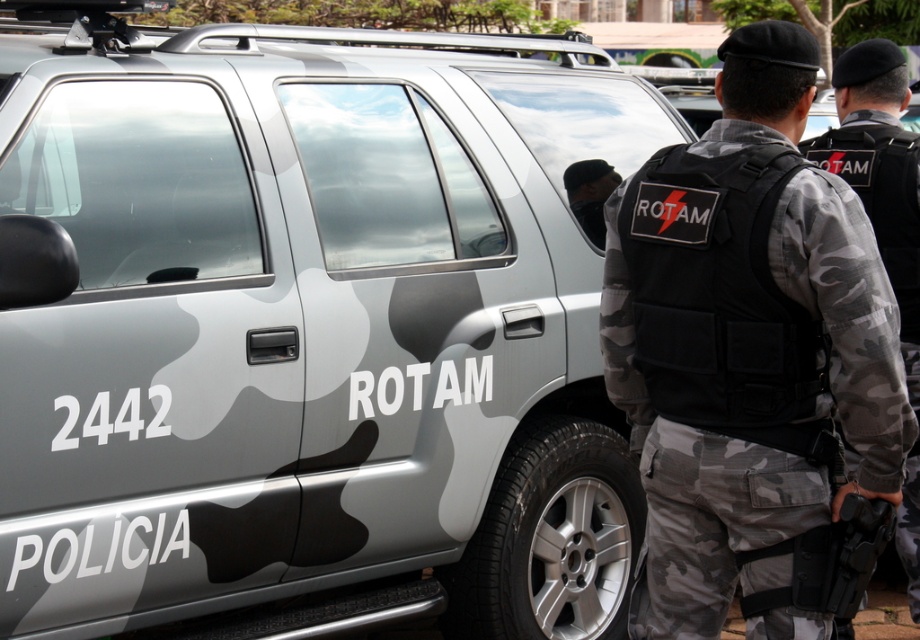
Question: Among these objects, which one is nearest to the camera?

Choices:
 (A) camouflage fabric vest at center
 (B) black tactical vest at center

Answer: (B)

Question: Considering the relative positions of black tactical vest at center and camouflage fabric vest at center in the image provided, where is black tactical vest at center located with respect to camouflage fabric vest at center?

Choices:
 (A) below
 (B) above

Answer: (B)

Question: Where is black tactical vest at center located in relation to camouflage fabric vest at center in the image?

Choices:
 (A) left
 (B) right

Answer: (A)

Question: Which of the following is the farthest from the observer?

Choices:
 (A) black tactical vest at center
 (B) camouflage fabric vest at center

Answer: (B)

Question: Is black tactical vest at center further to camera compared to camouflage fabric vest at center?

Choices:
 (A) yes
 (B) no

Answer: (B)